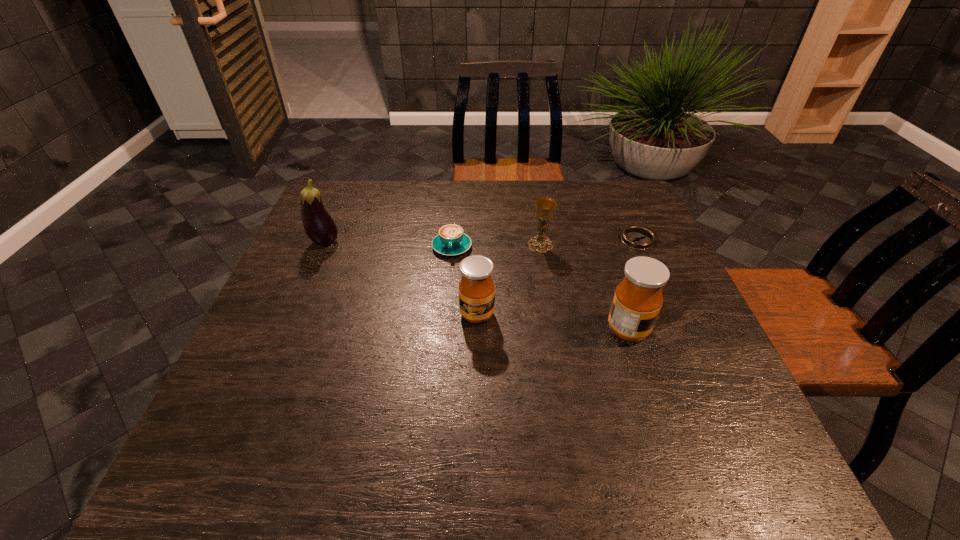
Please point out where to position a new honey on the left to maintain spacing. Please provide its 2D coordinates. Your answer should be formatted as a tuple, i.e. [(x, y)], where the tuple contains the x and y coordinates of a point satisfying the conditions above.

[(336, 300)]